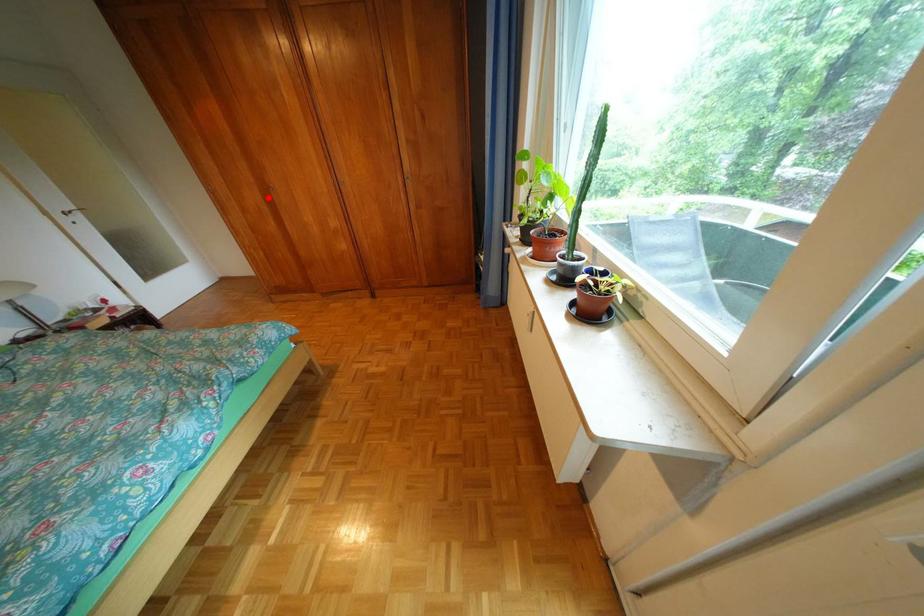
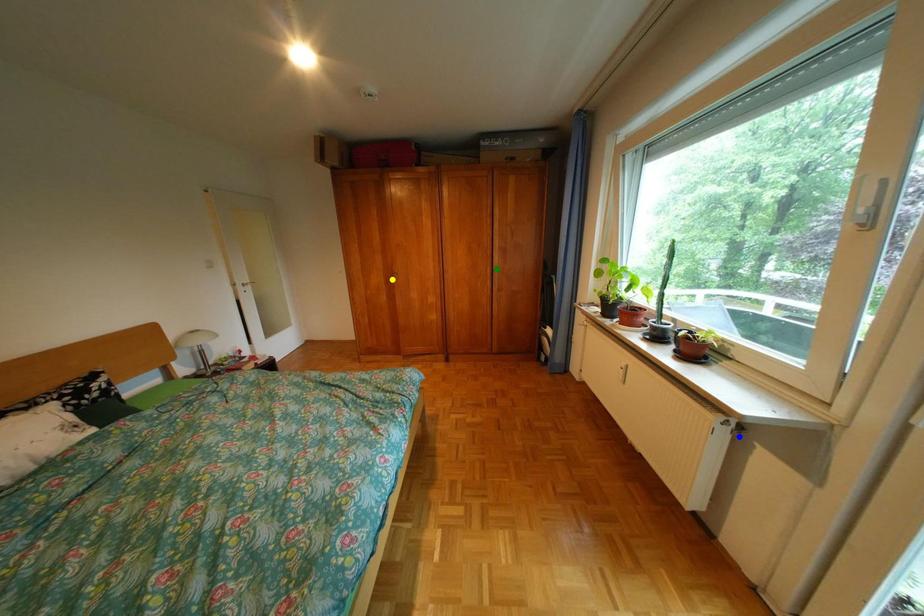
Question: I am providing you with two images of the same scene from different viewpoints. A red point is marked on the first image. You are given multiple points on the second image. Can you choose the point in image 2 that corresponds to the point in image 1?

Choices:
 (A) blue point
 (B) yellow point
 (C) green point

Answer: (B)